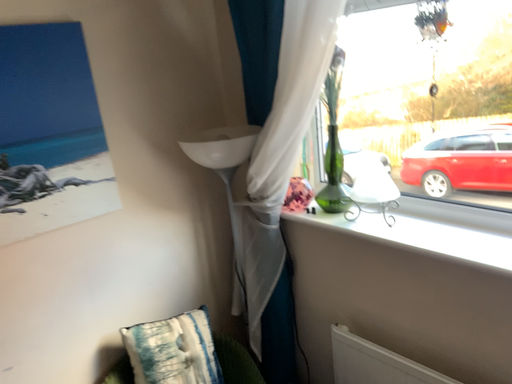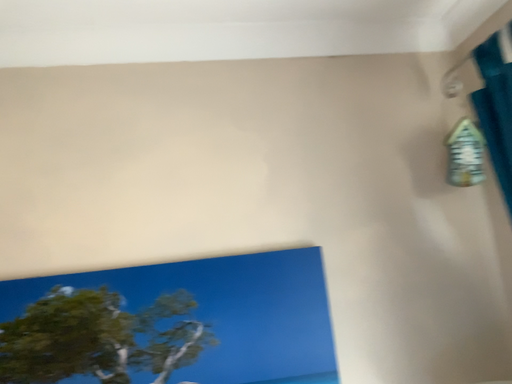
Question: How did the camera likely rotate when shooting the video?

Choices:
 (A) rotated right
 (B) rotated left

Answer: (B)